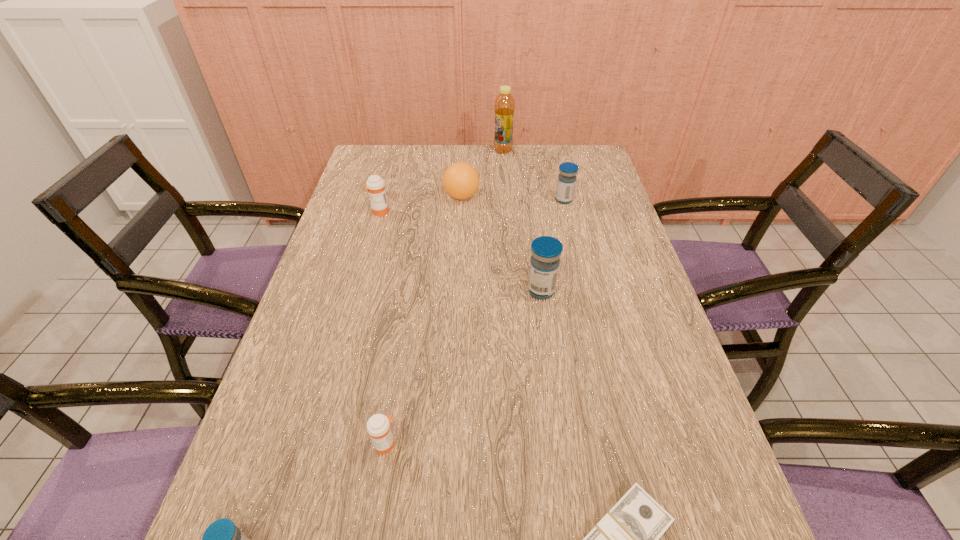
Locate an element on the screen. the fourth farthest medicine is located at coordinates (378, 426).

Where is `vacant space located 0.130m on the front of the bottle`? vacant space located 0.130m on the front of the bottle is located at coordinates (505, 174).

Where is `vacant space located on the back of the biggest blue medicine`? This screenshot has height=540, width=960. vacant space located on the back of the biggest blue medicine is located at coordinates (534, 238).

The width and height of the screenshot is (960, 540). I want to click on free location located on the front of the farthest blue medicine, so click(x=582, y=274).

I want to click on vacant space situated 0.300m on the right of the farther orange medicine, so click(485, 212).

This screenshot has width=960, height=540. What are the coordinates of `vacant space situated 0.300m on the side with brand of the fourth object from left to right` in the screenshot? It's located at (571, 197).

The height and width of the screenshot is (540, 960). What are the coordinates of `free location located on the back of the third nearest object` in the screenshot? It's located at (409, 298).

The width and height of the screenshot is (960, 540). What are the coordinates of `object present at the far edge` in the screenshot? It's located at (504, 106).

Locate an element on the screen. object that is at the left edge is located at coordinates (375, 184).

Where is `object situated at the right edge`? object situated at the right edge is located at coordinates (566, 182).